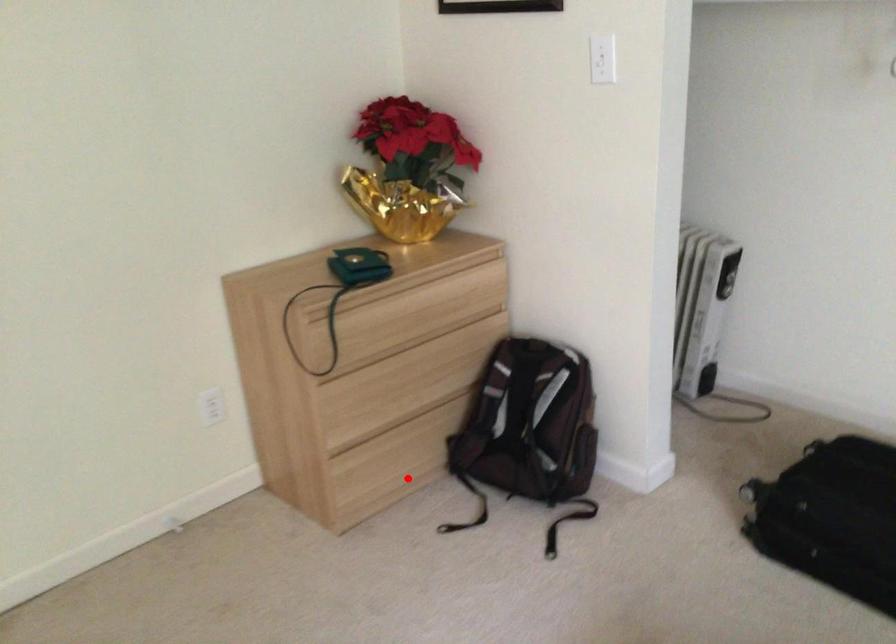
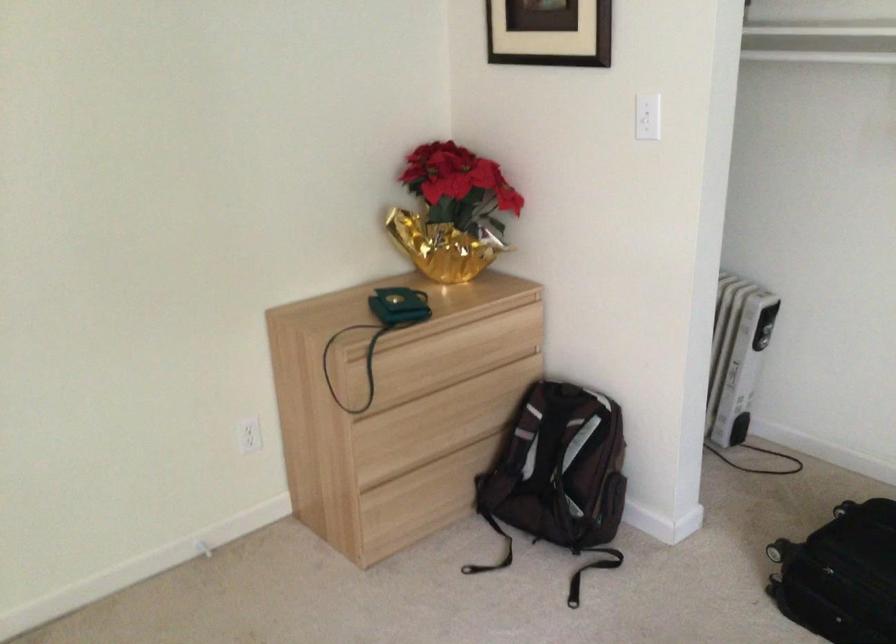
Find the pixel in the second image that matches the highlighted location in the first image.

(435, 516)